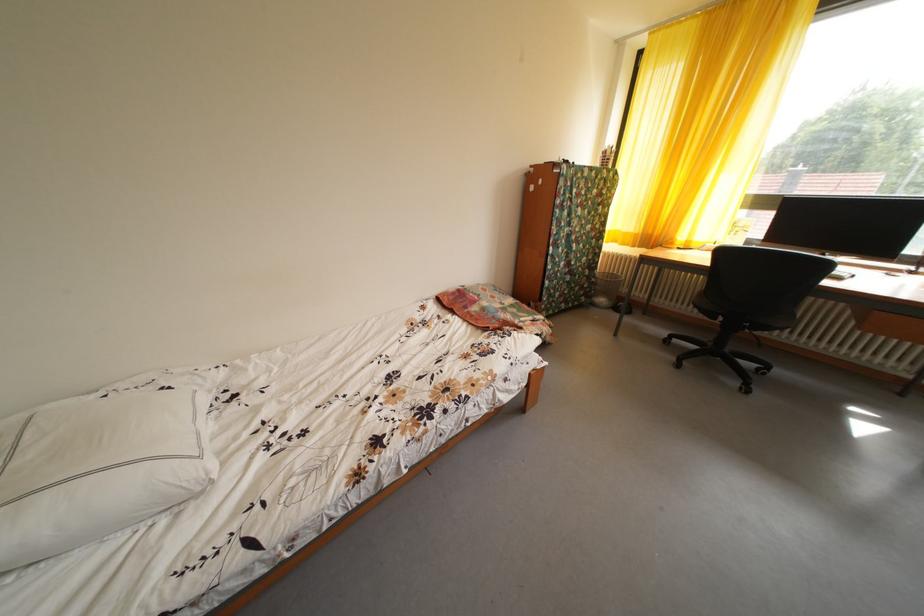
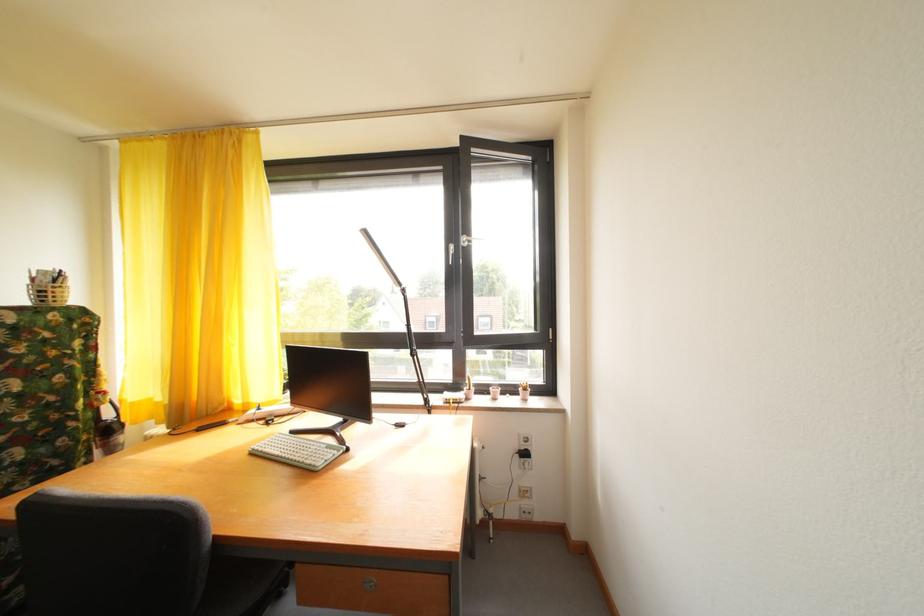
Where in the second image is the point corresponding to point (614, 159) from the first image?

(43, 286)